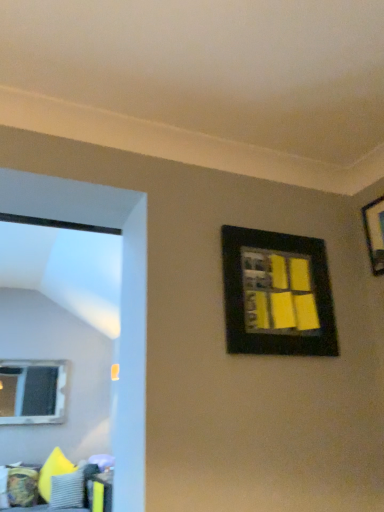
Question: Would you say textured fabric couch at lower left is to the left or to the right of black matte picture frame at upper right, acting as the 1th picture frame starting from the left, in the picture?

Choices:
 (A) left
 (B) right

Answer: (A)

Question: From a real-world perspective, is textured fabric couch at lower left physically located above or below black matte picture frame at upper right, acting as the 1th picture frame starting from the left?

Choices:
 (A) below
 (B) above

Answer: (A)

Question: Estimate the real-world distances between objects in this image. Which object is farther from the black matte picture frame at upper right, the 2th picture frame when ordered from right to left?

Choices:
 (A) black matte picture frame at upper right, which is the 2th picture frame from left to right
 (B) gray textured pillow at lower left
 (C) clear glass window at left
 (D) textured fabric couch at lower left

Answer: (C)

Question: Considering the real-world distances, which object is farthest from the black matte picture frame at upper right, the 2th picture frame when ordered from right to left?

Choices:
 (A) black matte picture frame at upper right, which is the 2th picture frame from left to right
 (B) gray textured pillow at lower left
 (C) textured fabric couch at lower left
 (D) clear glass window at left

Answer: (D)